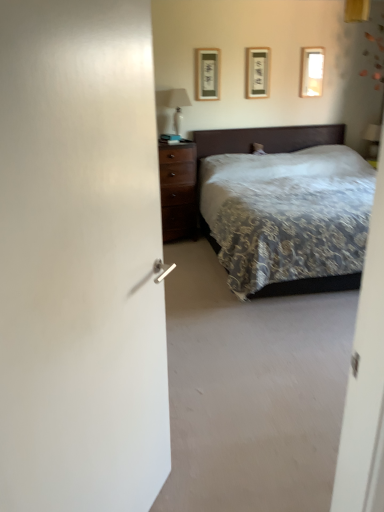
Question: Would you say matte white plastic table lamp at upper right, the 1th table lamp in the back-to-front sequence, is outside white glossy table lamp at upper center, acting as the 1th table lamp starting from the front?

Choices:
 (A) no
 (B) yes

Answer: (B)

Question: Is white glossy table lamp at upper center, placed as the second table lamp when sorted from right to left, inside matte white plastic table lamp at upper right, which is the 2th table lamp in front-to-back order?

Choices:
 (A) yes
 (B) no

Answer: (B)

Question: From a real-world perspective, is matte white plastic table lamp at upper right, acting as the 1th table lamp starting from the right, over white glossy table lamp at upper center, placed as the second table lamp when sorted from right to left?

Choices:
 (A) yes
 (B) no

Answer: (B)

Question: Is matte white plastic table lamp at upper right, the 1th table lamp in the back-to-front sequence, looking in the opposite direction of white glossy table lamp at upper center, the 2th table lamp in the back-to-front sequence?

Choices:
 (A) yes
 (B) no

Answer: (B)

Question: Considering the relative sizes of matte white plastic table lamp at upper right, acting as the 2th table lamp starting from the left, and white glossy table lamp at upper center, acting as the 1th table lamp starting from the front, in the image provided, is matte white plastic table lamp at upper right, acting as the 2th table lamp starting from the left, taller than white glossy table lamp at upper center, acting as the 1th table lamp starting from the front,?

Choices:
 (A) yes
 (B) no

Answer: (B)

Question: Is patterned fabric bed at center to the left or to the right of matte white plastic table lamp at upper right, the 1th table lamp in the back-to-front sequence, in the image?

Choices:
 (A) right
 (B) left

Answer: (B)

Question: Is point (240, 147) positioned closer to the camera than point (372, 144)?

Choices:
 (A) farther
 (B) closer

Answer: (B)

Question: Considering the positions of patterned fabric bed at center and matte white plastic table lamp at upper right, acting as the 1th table lamp starting from the right, in the image, is patterned fabric bed at center wider or thinner than matte white plastic table lamp at upper right, acting as the 1th table lamp starting from the right,?

Choices:
 (A) thin
 (B) wide

Answer: (B)

Question: Considering the positions of patterned fabric bed at center and matte white plastic table lamp at upper right, which is the 2th table lamp in front-to-back order, in the image, is patterned fabric bed at center taller or shorter than matte white plastic table lamp at upper right, which is the 2th table lamp in front-to-back order,?

Choices:
 (A) tall
 (B) short

Answer: (A)

Question: Which is correct: white glossy table lamp at upper center, marked as the 1th table lamp in a left-to-right arrangement, is inside matte glass picture frame at upper right, the 3th picture frame positioned from the left, or outside of it?

Choices:
 (A) outside
 (B) inside

Answer: (A)

Question: From a real-world perspective, is white glossy table lamp at upper center, marked as the 1th table lamp in a left-to-right arrangement, physically located above or below matte glass picture frame at upper right, the 3th picture frame positioned from the left?

Choices:
 (A) below
 (B) above

Answer: (A)

Question: From the image's perspective, is white glossy table lamp at upper center, acting as the 1th table lamp starting from the front, positioned above or below matte glass picture frame at upper right, the 1th picture frame when ordered from right to left?

Choices:
 (A) below
 (B) above

Answer: (A)

Question: Based on their positions, is white glossy table lamp at upper center, acting as the 1th table lamp starting from the front, located to the left or right of matte glass picture frame at upper right, the 3th picture frame positioned from the left?

Choices:
 (A) right
 (B) left

Answer: (B)

Question: Is matte glass picture frame at upper right, the 1th picture frame when ordered from right to left, taller or shorter than white glossy table lamp at upper center, marked as the 1th table lamp in a left-to-right arrangement?

Choices:
 (A) tall
 (B) short

Answer: (B)

Question: Is point (301, 67) positioned closer to the camera than point (177, 103)?

Choices:
 (A) farther
 (B) closer

Answer: (A)